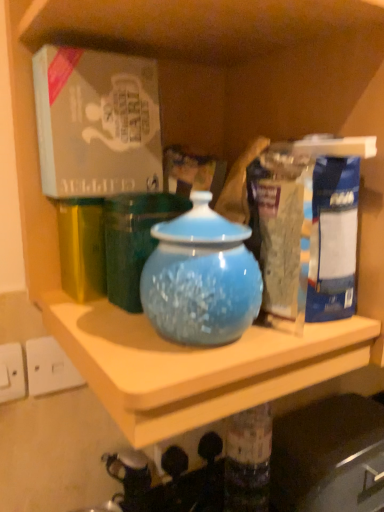
The height and width of the screenshot is (512, 384). I want to click on blue glass jar at center, so (x=201, y=278).

The image size is (384, 512). Describe the element at coordinates (201, 278) in the screenshot. I see `blue glass jar at center` at that location.

What is the approximate height of blue glass jar at center?

blue glass jar at center is 7.37 inches in height.

This screenshot has width=384, height=512. Identify the location of blue glass jar at center. (201, 278).